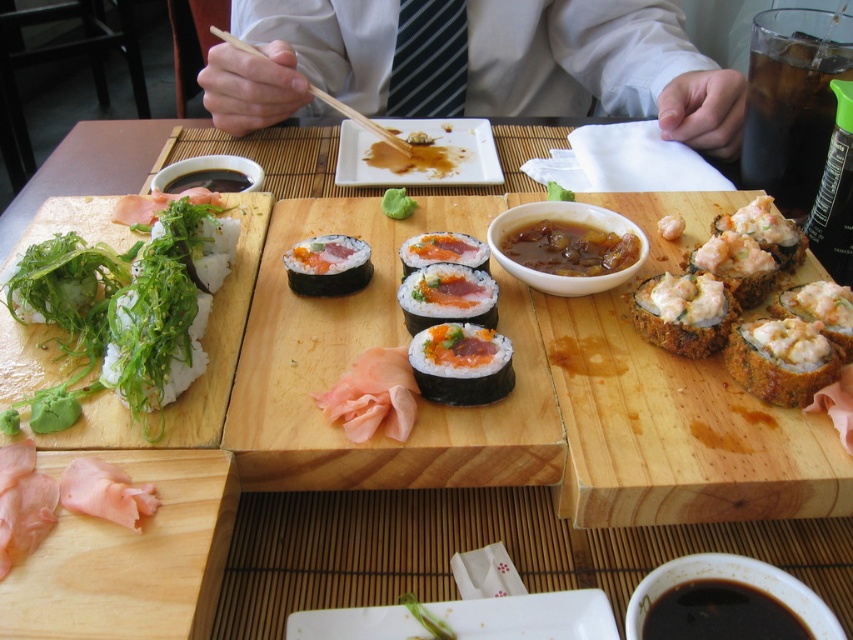
Between smokey salmon sushi at center and shiny pink salmon at center, which one has less height?

shiny pink salmon at center

Is smokey salmon sushi at center above shiny pink salmon at center?

No.

Who is more distant from viewer, (463, 301) or (479, 259)?

Positioned behind is point (479, 259).

This screenshot has width=853, height=640. I want to click on smokey salmon sushi at center, so click(447, 296).

Measure the distance between wooden cutting board at center and camera.

38.90 centimeters

Is wooden cutting board at center bigger than brown glossy sauce at center?

Indeed, wooden cutting board at center has a larger size compared to brown glossy sauce at center.

This screenshot has height=640, width=853. Find the location of `wooden cutting board at center`. wooden cutting board at center is located at coordinates (375, 346).

Does green seaweed at upper left appear under pink raw meat at lower left?

Correct, green seaweed at upper left is located below pink raw meat at lower left.

Is green seaweed at upper left thinner than pink raw meat at lower left?

Incorrect, green seaweed at upper left's width is not less than pink raw meat at lower left's.

At what (x,y) coordinates should I click in order to perform the action: click on green seaweed at upper left. Please return your answer as a coordinate pair (x, y). The height and width of the screenshot is (640, 853). Looking at the image, I should click on (529, 616).